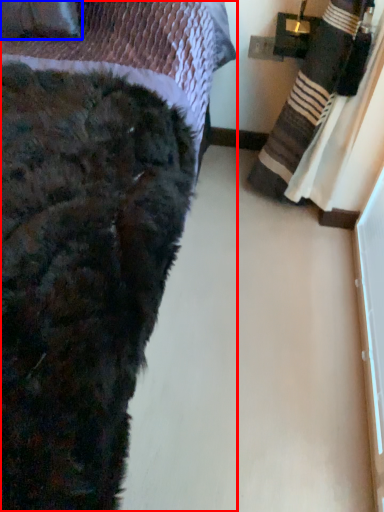
Question: Which object is closer to the camera taking this photo, bed (highlighted by a red box) or throw pillow (highlighted by a blue box)?

Choices:
 (A) bed
 (B) throw pillow

Answer: (A)